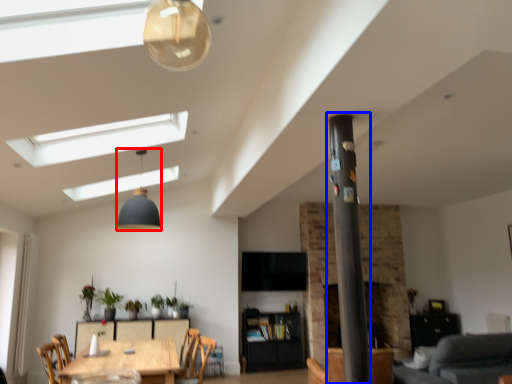
Question: Which point is further to the camera, light fixture (highlighted by a red box) or pillar (highlighted by a blue box)?

Choices:
 (A) light fixture
 (B) pillar

Answer: (A)